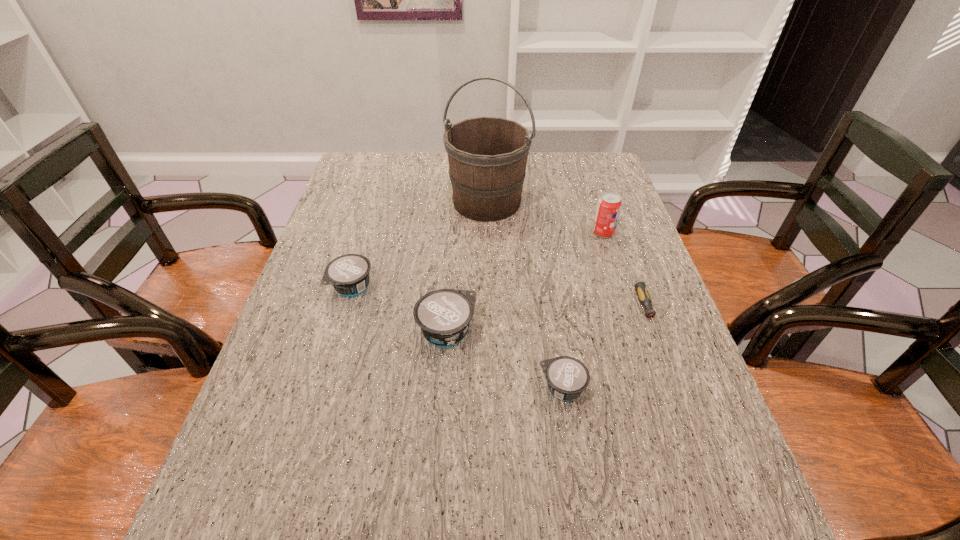
In the image, there is a desktop. Where is `vacant area at the near edge`? This screenshot has width=960, height=540. vacant area at the near edge is located at coordinates (620, 476).

In the image, there is a desktop. Identify the location of vacant space at the left edge. The height and width of the screenshot is (540, 960). (334, 336).

This screenshot has width=960, height=540. What are the coordinates of `vacant space at the right edge of the desktop` in the screenshot? It's located at (677, 410).

Where is `free space at the near left corner of the desktop`? This screenshot has height=540, width=960. free space at the near left corner of the desktop is located at coordinates (278, 472).

This screenshot has height=540, width=960. What are the coordinates of `free space at the far right corner of the desktop` in the screenshot? It's located at (563, 167).

This screenshot has width=960, height=540. I want to click on vacant space in between the fifth shortest object and the shortest object, so click(x=626, y=275).

The width and height of the screenshot is (960, 540). In order to click on empty space that is in between the screwdriver and the soda can in this screenshot , I will do `click(626, 275)`.

Locate an element on the screen. The width and height of the screenshot is (960, 540). vacant space that is in between the second tallest object and the screwdriver is located at coordinates (626, 275).

This screenshot has height=540, width=960. In order to click on vacant area between the shortest yogurt and the shortest object in this screenshot , I will do `click(606, 353)`.

The image size is (960, 540). Find the location of `free space between the soda can and the farthest yogurt`. free space between the soda can and the farthest yogurt is located at coordinates (478, 260).